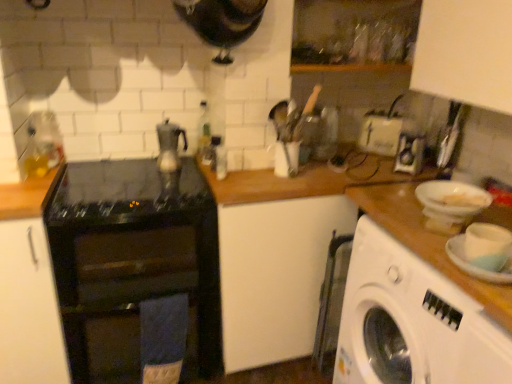
Question: From a real-world perspective, is white plastic washing machine at right over transparent glass bottle at upper center?

Choices:
 (A) no
 (B) yes

Answer: (A)

Question: Is white plastic washing machine at right at the right side of transparent glass bottle at upper center?

Choices:
 (A) no
 (B) yes

Answer: (B)

Question: Can we say white plastic washing machine at right lies outside transparent glass bottle at upper center?

Choices:
 (A) no
 (B) yes

Answer: (B)

Question: Does white plastic washing machine at right have a lesser width compared to transparent glass bottle at upper center?

Choices:
 (A) no
 (B) yes

Answer: (A)

Question: Can you confirm if white plastic washing machine at right is bigger than transparent glass bottle at upper center?

Choices:
 (A) no
 (B) yes

Answer: (B)

Question: From the image's perspective, is white plastic washing machine at right below transparent glass bottle at upper center?

Choices:
 (A) yes
 (B) no

Answer: (A)

Question: Is white plastic basin at right outside black glass stove at center?

Choices:
 (A) no
 (B) yes

Answer: (B)

Question: Could you tell me if white plastic basin at right is facing black glass stove at center?

Choices:
 (A) no
 (B) yes

Answer: (A)

Question: Would you consider white plastic basin at right to be distant from black glass stove at center?

Choices:
 (A) yes
 (B) no

Answer: (A)

Question: From the image's perspective, is white plastic basin at right located beneath black glass stove at center?

Choices:
 (A) yes
 (B) no

Answer: (B)

Question: Is white plastic basin at right in front of black glass stove at center?

Choices:
 (A) no
 (B) yes

Answer: (B)

Question: Is white plastic basin at right smaller than black glass stove at center?

Choices:
 (A) yes
 (B) no

Answer: (A)

Question: Can you confirm if transparent glass bottle at upper center is bigger than satin silver teapot at center?

Choices:
 (A) yes
 (B) no

Answer: (B)